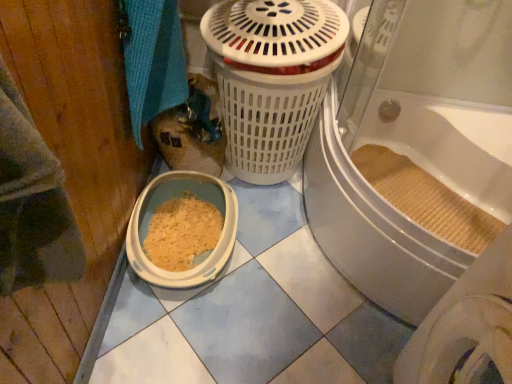
Question: Based on their positions, is blue woven towel at upper left located to the left or right of white plastic litter box at lower left?

Choices:
 (A) left
 (B) right

Answer: (A)

Question: Is blue woven towel at upper left wider or thinner than white plastic litter box at lower left?

Choices:
 (A) thin
 (B) wide

Answer: (A)

Question: Estimate the real-world distances between objects in this image. Which object is closer to the beige woven mat at bathtub?

Choices:
 (A) white textured bath at center
 (B) blue woven towel at upper left
 (C) white plastic litter box at lower left

Answer: (A)

Question: Estimate the real-world distances between objects in this image. Which object is closer to the beige woven mat at bathtub?

Choices:
 (A) blue woven towel at upper left
 (B) white textured bath at center
 (C) white plastic litter box at lower left

Answer: (B)